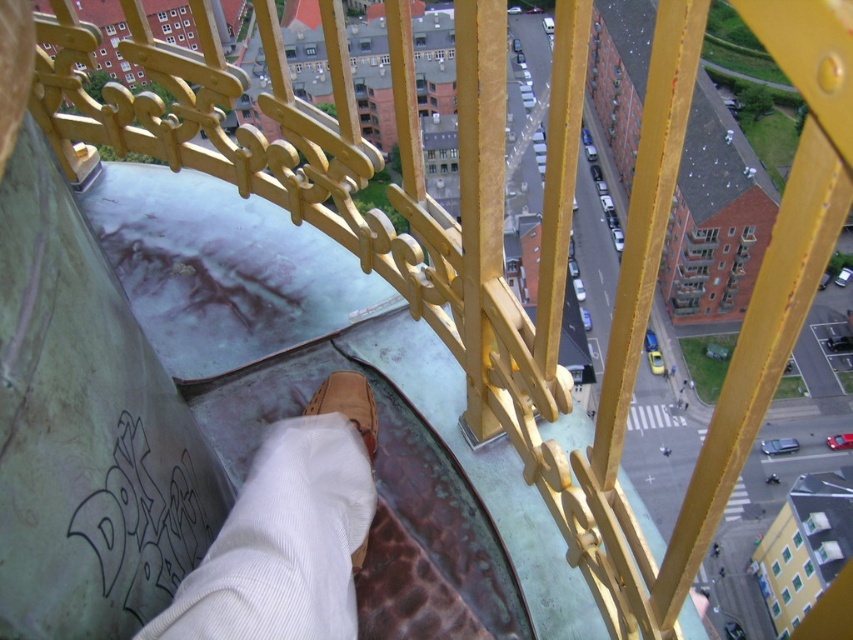
Question: Is brown leather shoe at lower center smaller than brown leather shoe at center?

Choices:
 (A) yes
 (B) no

Answer: (B)

Question: Which point is closer to the camera?

Choices:
 (A) (325, 403)
 (B) (161, 627)

Answer: (B)

Question: Can you confirm if brown leather shoe at lower center is bigger than brown leather shoe at center?

Choices:
 (A) no
 (B) yes

Answer: (B)

Question: Which point appears farthest from the camera in this image?

Choices:
 (A) (337, 385)
 (B) (309, 420)

Answer: (A)

Question: Can you confirm if brown leather shoe at lower center is positioned below brown leather shoe at center?

Choices:
 (A) yes
 (B) no

Answer: (A)